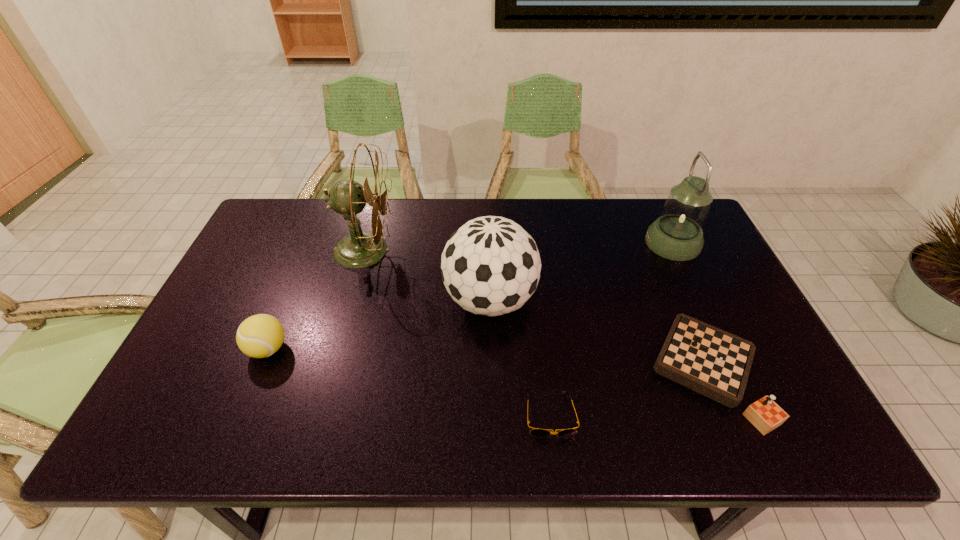
Image resolution: width=960 pixels, height=540 pixels. What are the coordinates of `free spot between the leftmost object and the chessboard` in the screenshot? It's located at (488, 361).

The image size is (960, 540). In order to click on free spot between the chessboard and the soccer ball in this screenshot , I will do `click(599, 336)`.

You are a GUI agent. You are given a task and a screenshot of the screen. Output one action in this format:
    pyautogui.click(x=<x>, y=<y>)
    Task: Click on the free spot between the lantern and the second shortest object
    
    Given the screenshot: What is the action you would take?
    pyautogui.click(x=690, y=308)

This screenshot has height=540, width=960. What are the coordinates of `blank region between the sunglasses and the second shortest object` in the screenshot? It's located at (629, 394).

Where is `free space between the third shortest object and the shortest object`? This screenshot has height=540, width=960. free space between the third shortest object and the shortest object is located at coordinates (409, 382).

This screenshot has width=960, height=540. Identify the location of object that is the fifth closest to the tennis ball. (677, 234).

The height and width of the screenshot is (540, 960). Find the location of `the fourth closest object to the fourth shortest object`. the fourth closest object to the fourth shortest object is located at coordinates (677, 234).